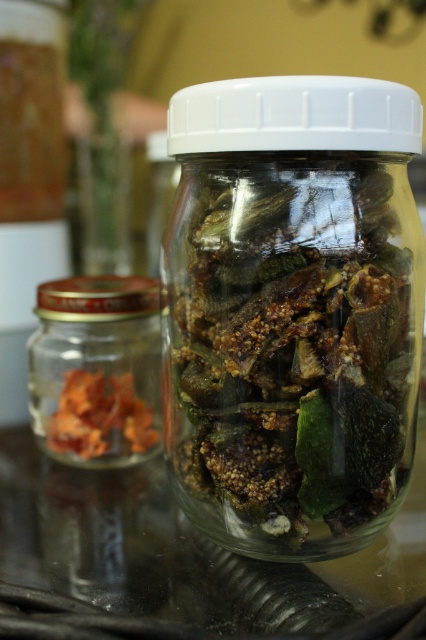
You are organizing a pantry and need to place the brown matte dried figs at center and the translucent glass jar at left on a shelf. Given their sizes, which item should you place first to ensure both fit properly?

Since the brown matte dried figs at center occupies less space than the translucent glass jar at left, you should place the translucent glass jar at left first to accommodate its larger size, then fit the smaller brown matte dried figs at center around it.

You are a chef preparing a dish and need to place a brown matte dried figs at center and a translucent glass jar at left on a shelf. The shelf has a width of 6 inches. Can both items fit side by side without overlapping?

The distance between the brown matte dried figs at center and the translucent glass jar at left is 5.78 inches, so they can fit side by side on the 6 inch shelf since the total space needed is less than the shelf width.

Looking at this image, you are a delivery person who needs to place a package on the table where the translucent glass jar at left is located. The package is 18 inches long. Can you safely place the package on the table without it overlapping the jar?

The translucent glass jar at left is 17.72 inches away from the viewer, so the package that is 18 inches long may overlap the jar when placed on the table. It is recommended to check the available space carefully before placing the package to avoid any overlap.